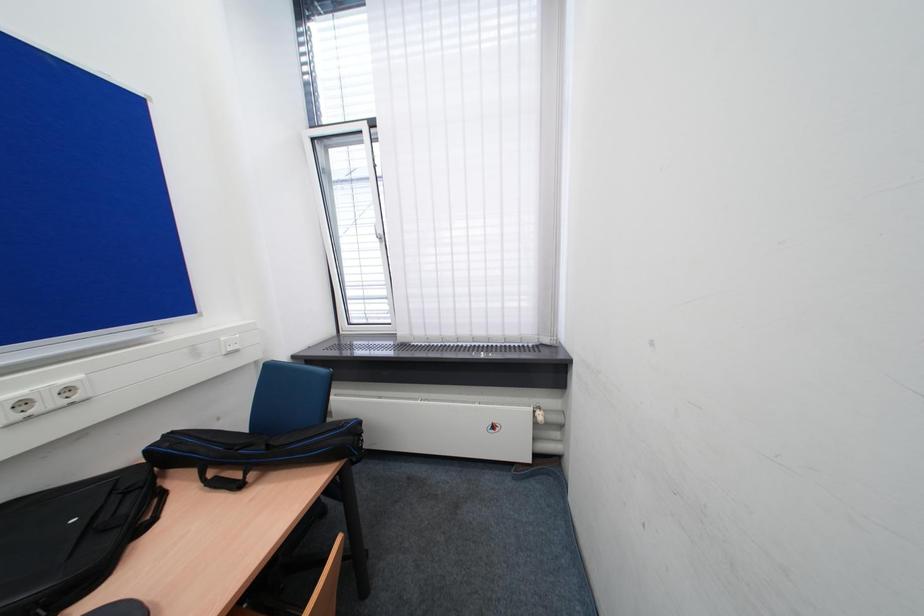
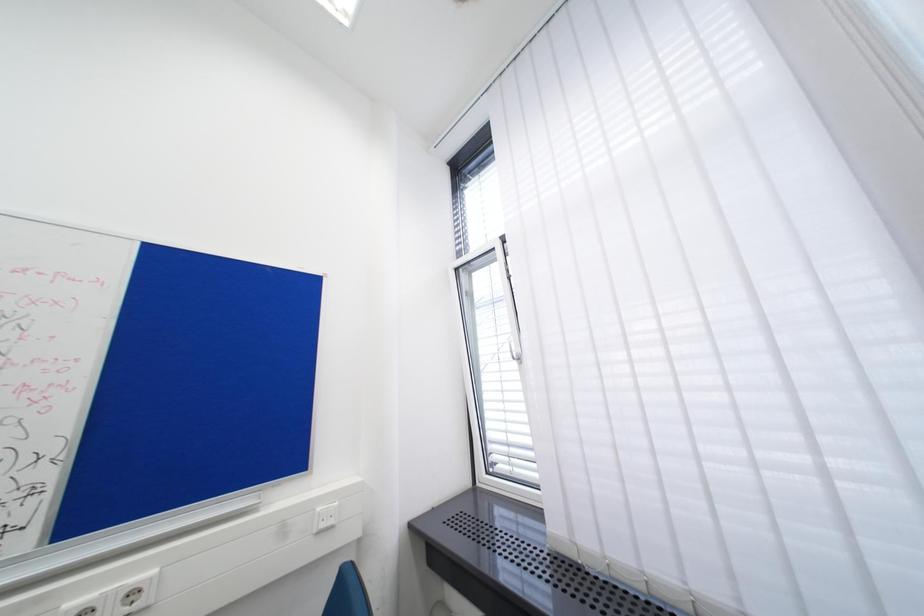
How did the camera likely rotate?

The camera rotated toward left-up.